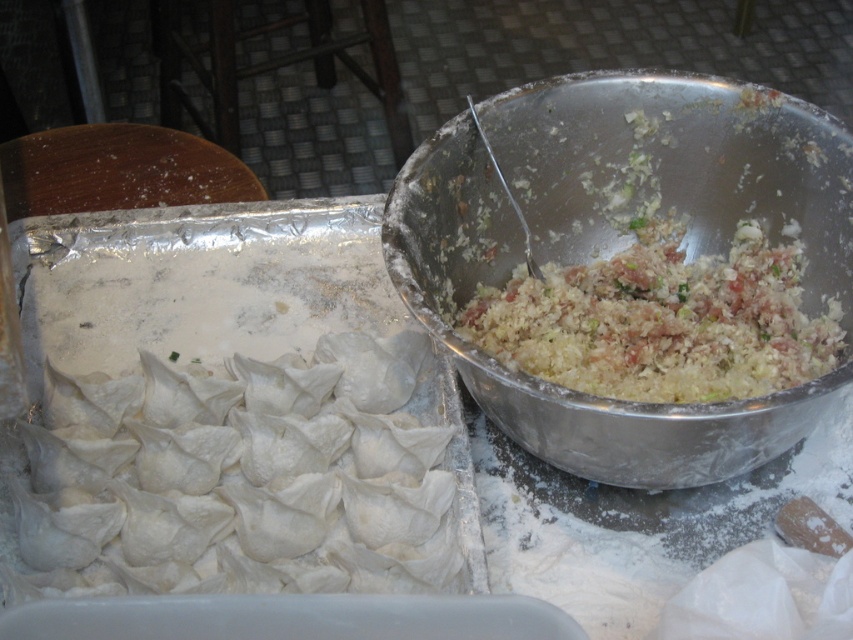
You are a chef preparing dumplings and need to place a new bowl of sauce exactly where the metallic silver bowl at center was. What coordinates should you use to place the new bowl?

The coordinates for the metallic silver bowl at center are at point (624, 246), so you should place the new bowl there.

You are a food photographer setting up a shot for the dumplings. You have two points marked in the scene, point A at coordinates point (126,572) and point B at coordinates point (747,284). Which point is closer to your camera lens?

Point point (126,572) is closer to the viewer than point point (747,284), so point A is closer to the camera lens.

You are a food photographer and need to adjust the lighting to highlight the white doughy dumplings at left. Given their position, where should you place the light source relative to the tray?

The white doughy dumplings at left are located at point (241, 476). To highlight them effectively, position the light source directly above or slightly to the side opposite of their location on the tray.